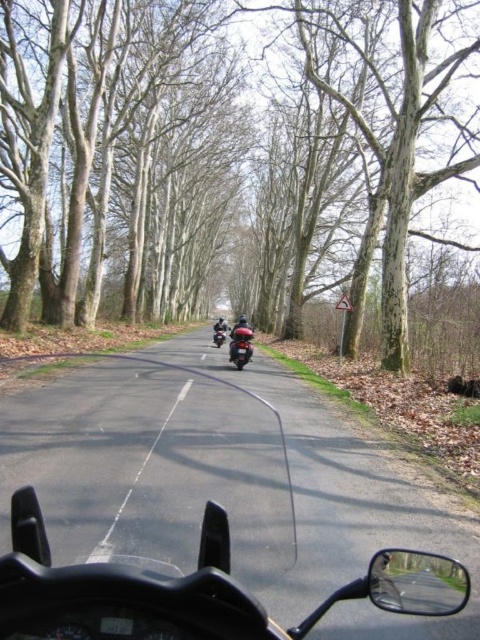
Question: Estimate the real-world distances between objects in this image. Which object is closer to the black matte motorcycle at center?

Choices:
 (A) shiny black scooter at center
 (B) shiny black motorcycle at center

Answer: (B)

Question: Which of the following is the closest to the observer?

Choices:
 (A) (180, 237)
 (B) (235, 332)

Answer: (B)

Question: Can you confirm if smooth bark tree at center is positioned to the left of shiny black scooter at center?

Choices:
 (A) yes
 (B) no

Answer: (A)

Question: Is smooth bark tree at center above shiny black motorcycle at center?

Choices:
 (A) no
 (B) yes

Answer: (B)

Question: Does smooth bark tree at center appear on the left side of white asphalt road at center?

Choices:
 (A) no
 (B) yes

Answer: (B)

Question: Which of the following is the closest to the observer?

Choices:
 (A) (218, 333)
 (B) (108, 60)
 (C) (236, 362)
 (D) (136, 470)

Answer: (D)